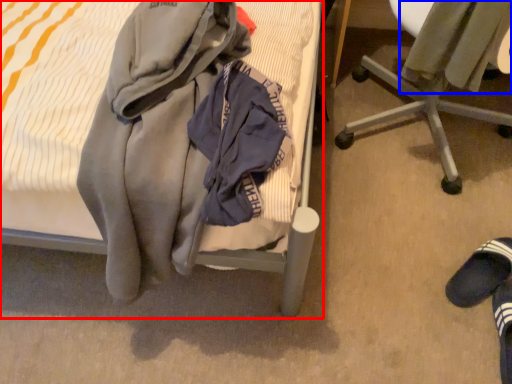
Question: Which object is further to the camera taking this photo, bed (highlighted by a red box) or sweater (highlighted by a blue box)?

Choices:
 (A) bed
 (B) sweater

Answer: (B)